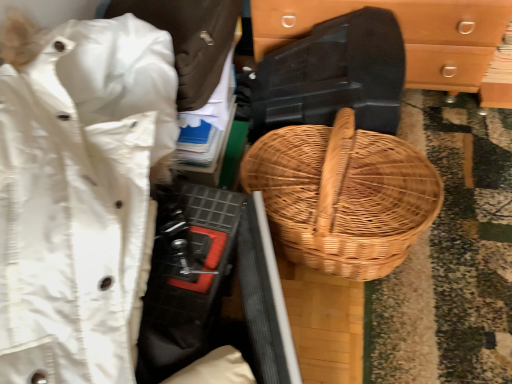
Where is `free point in front of brown wicker picnic basket at center`? free point in front of brown wicker picnic basket at center is located at coordinates (376, 336).